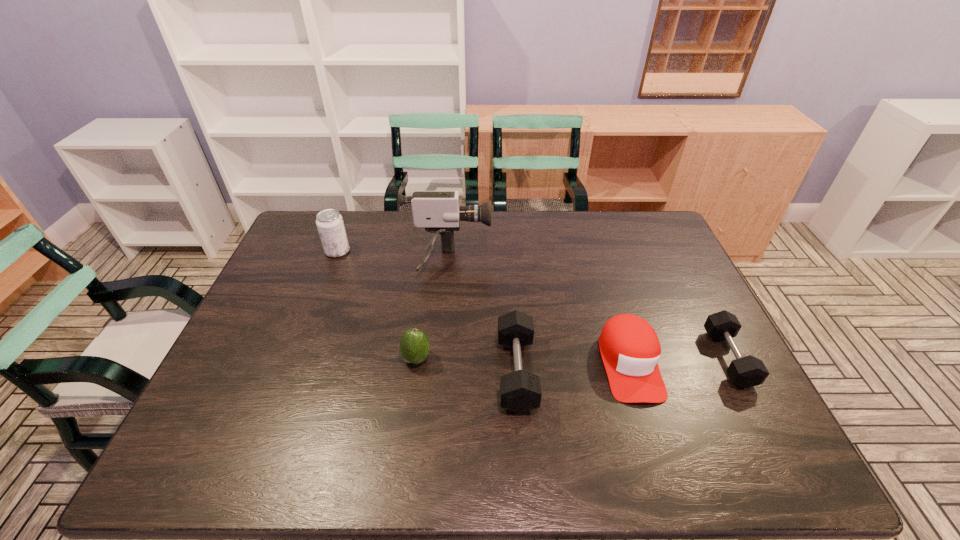
The image size is (960, 540). Identify the location of vacant space positioned on the left of the right dumbbell. (611, 358).

Where is `free space located on the left of the soda can`? This screenshot has height=540, width=960. free space located on the left of the soda can is located at coordinates (283, 251).

Where is `vacant space located on the recording direction of the camcorder`? This screenshot has width=960, height=540. vacant space located on the recording direction of the camcorder is located at coordinates click(x=570, y=262).

Where is `free space located on the back of the avocado`? The image size is (960, 540). free space located on the back of the avocado is located at coordinates (425, 293).

What are the coordinates of `soda can present at the far edge` in the screenshot? It's located at (330, 224).

This screenshot has height=540, width=960. I want to click on camcorder located at the far edge, so click(438, 212).

This screenshot has width=960, height=540. Identify the location of dumbbell at the near edge. (520, 391).

Identify the location of baseball cap at the near edge. This screenshot has height=540, width=960. (630, 349).

This screenshot has width=960, height=540. Find the location of `object that is at the left edge`. object that is at the left edge is located at coordinates (330, 224).

Identify the location of object located in the right edge section of the desktop. (745, 372).